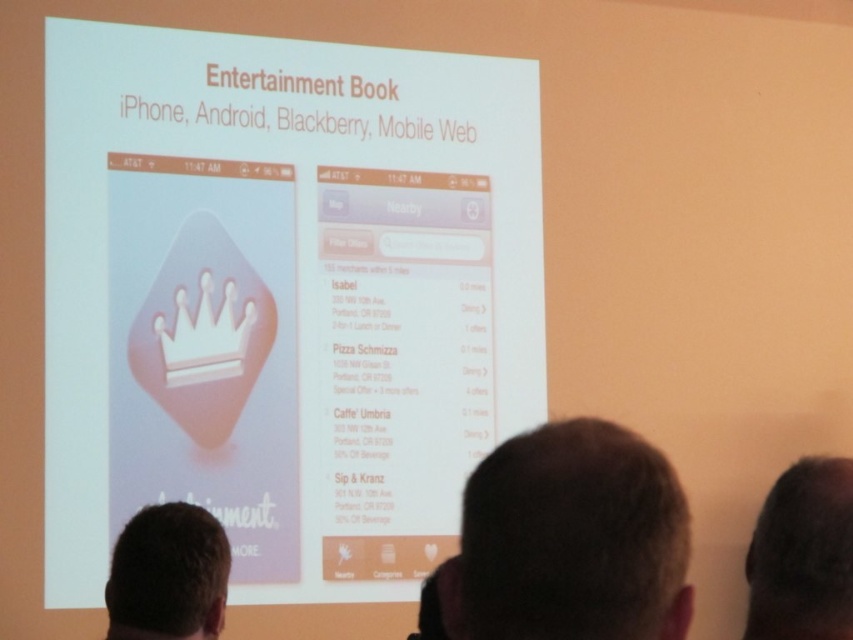
Does white glossy screen at center have a lesser width compared to dark brown hair at lower center?

Incorrect, white glossy screen at center's width is not less than dark brown hair at lower center's.

Does point (50, 253) come in front of point (627, 433)?

No, (50, 253) is further to viewer.

Does point (198, 301) come in front of point (471, 506)?

That is False.

Where is `white glossy screen at center`? white glossy screen at center is located at coordinates (283, 298).

From the picture: Who is lower down, dark brown hair at lower center or brown hair at lower left?

Positioned lower is brown hair at lower left.

Is dark brown hair at lower center behind brown hair at lower left?

No, dark brown hair at lower center is closer to the viewer.

Where is `dark brown hair at lower center`? dark brown hair at lower center is located at coordinates (569, 540).

Which of these two, dark brown hair at lower center or dark brown hair at upper right, stands shorter?

With less height is dark brown hair at upper right.

At what (x,y) coordinates should I click in order to perform the action: click on dark brown hair at lower center. Please return your answer as a coordinate pair (x, y). The image size is (853, 640). Looking at the image, I should click on (569, 540).

What do you see at coordinates (569, 540) in the screenshot?
I see `dark brown hair at lower center` at bounding box center [569, 540].

Find the location of `dark brown hair at lower center`. dark brown hair at lower center is located at coordinates (569, 540).